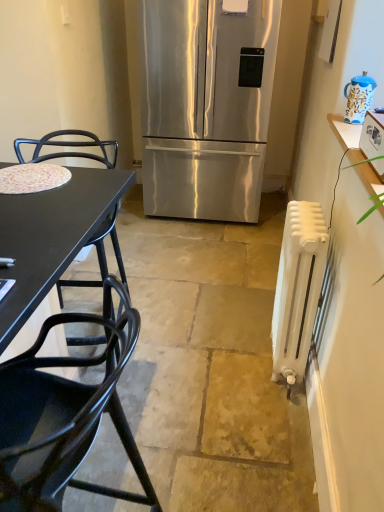
Question: Can you confirm if stainless steel refrigerator at center is bigger than blue and white ceramic teapot at upper right?

Choices:
 (A) yes
 (B) no

Answer: (A)

Question: Is stainless steel refrigerator at center to the left of blue and white ceramic teapot at upper right from the viewer's perspective?

Choices:
 (A) yes
 (B) no

Answer: (A)

Question: Does stainless steel refrigerator at center have a greater width compared to blue and white ceramic teapot at upper right?

Choices:
 (A) yes
 (B) no

Answer: (A)

Question: Is stainless steel refrigerator at center positioned with its back to blue and white ceramic teapot at upper right?

Choices:
 (A) yes
 (B) no

Answer: (B)

Question: Is stainless steel refrigerator at center oriented towards blue and white ceramic teapot at upper right?

Choices:
 (A) no
 (B) yes

Answer: (A)

Question: From the image's perspective, is black metal chair at left, which appears as the second chair when viewed from the front, located above or below blue and white ceramic teapot at upper right?

Choices:
 (A) above
 (B) below

Answer: (B)

Question: In the image, is black metal chair at left, the first chair positioned from the back, positioned in front of or behind blue and white ceramic teapot at upper right?

Choices:
 (A) behind
 (B) front

Answer: (B)

Question: Is black metal chair at left, which appears as the second chair when viewed from the front, to the left or to the right of blue and white ceramic teapot at upper right in the image?

Choices:
 (A) right
 (B) left

Answer: (B)

Question: Considering the positions of black metal chair at left, the first chair positioned from the back, and blue and white ceramic teapot at upper right in the image, is black metal chair at left, the first chair positioned from the back, bigger or smaller than blue and white ceramic teapot at upper right?

Choices:
 (A) small
 (B) big

Answer: (B)

Question: Looking at their shapes, would you say white plastic toaster at upper right is wider or thinner than black metal chair at left, the first chair positioned from the back?

Choices:
 (A) wide
 (B) thin

Answer: (B)

Question: Considering the positions of white plastic toaster at upper right and black metal chair at left, the first chair positioned from the back, in the image, is white plastic toaster at upper right taller or shorter than black metal chair at left, the first chair positioned from the back,?

Choices:
 (A) short
 (B) tall

Answer: (A)

Question: Does point (377, 137) appear closer or farther from the camera than point (77, 284)?

Choices:
 (A) closer
 (B) farther

Answer: (A)

Question: Is white plastic toaster at upper right in front of or behind black metal chair at left, which appears as the second chair when viewed from the front, in the image?

Choices:
 (A) behind
 (B) front

Answer: (B)

Question: Considering the positions of white plastic toaster at upper right and blue and white ceramic teapot at upper right in the image, is white plastic toaster at upper right taller or shorter than blue and white ceramic teapot at upper right?

Choices:
 (A) tall
 (B) short

Answer: (B)

Question: Relative to blue and white ceramic teapot at upper right, is white plastic toaster at upper right in front or behind?

Choices:
 (A) behind
 (B) front

Answer: (B)